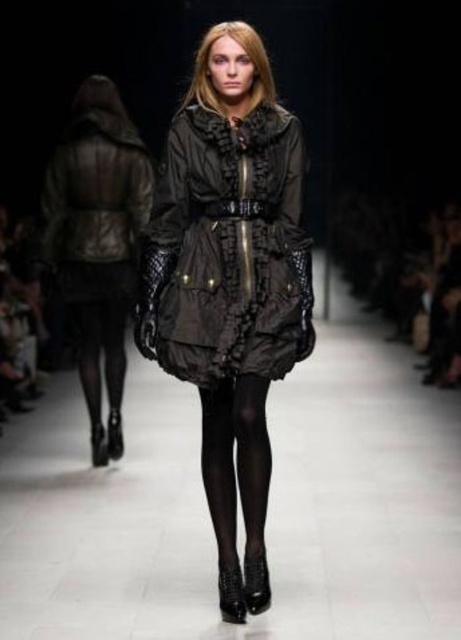
You are a photographer at the runway show. You need to capture a photo of the matte black dress at center and the black sheer tights at center. Which one is positioned to the left?

The matte black dress at center is positioned on the left side of black sheer tights at center, so the matte black dress at center is the one on the left.